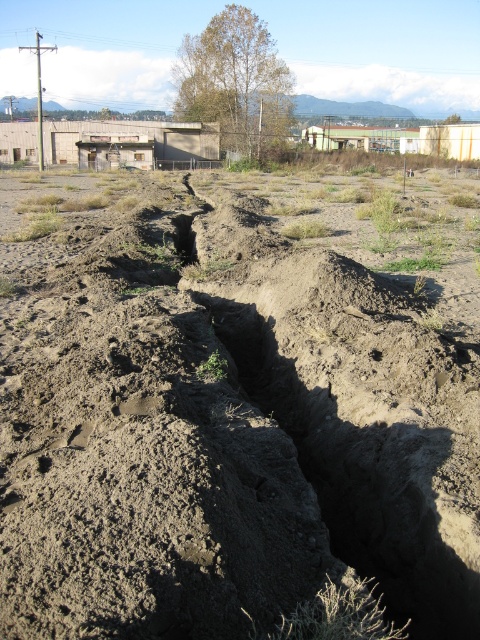
Question: Is dull brown dirt at center to the right of dark brown dirt at center from the viewer's perspective?

Choices:
 (A) yes
 (B) no

Answer: (B)

Question: Among these objects, which one is farthest from the camera?

Choices:
 (A) dark brown dirt at center
 (B) dull brown dirt at center

Answer: (A)

Question: Which object appears farthest from the camera in this image?

Choices:
 (A) dull brown dirt at center
 (B) dark brown dirt at center

Answer: (B)

Question: Can you confirm if dull brown dirt at center is positioned above dark brown dirt at center?

Choices:
 (A) no
 (B) yes

Answer: (A)

Question: Can you confirm if dull brown dirt at center is positioned above dark brown dirt at center?

Choices:
 (A) yes
 (B) no

Answer: (B)